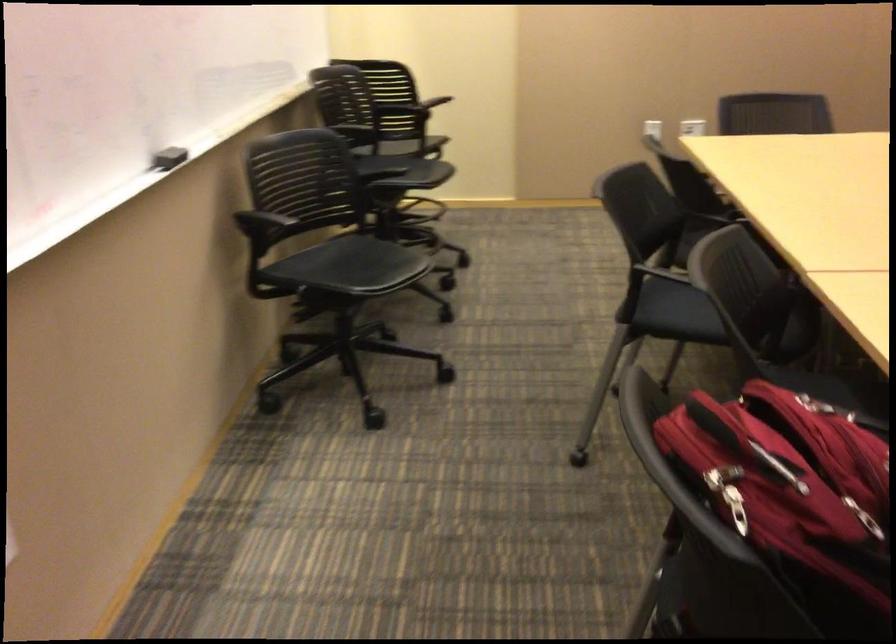
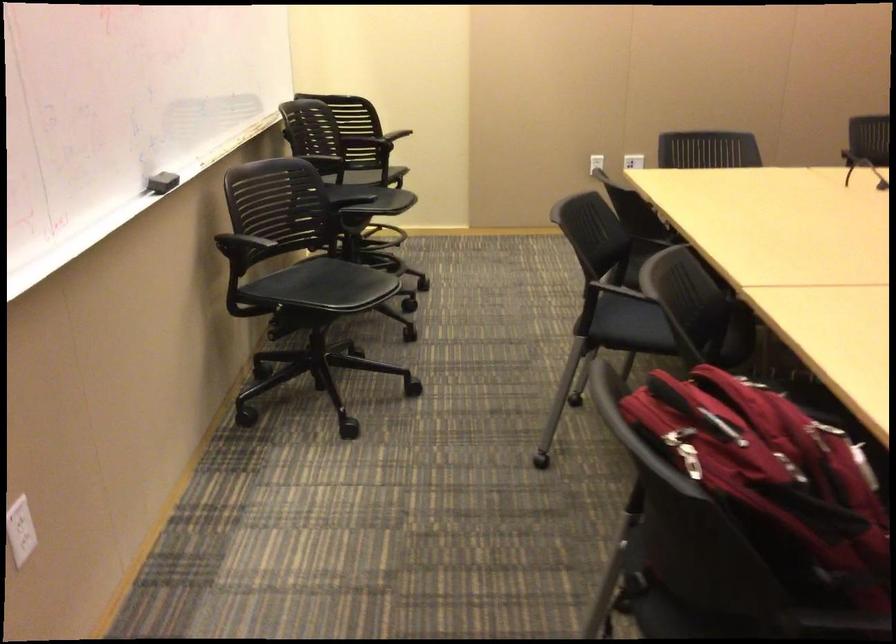
In the second image, find the point that corresponds to [672,307] in the first image.

(629, 324)